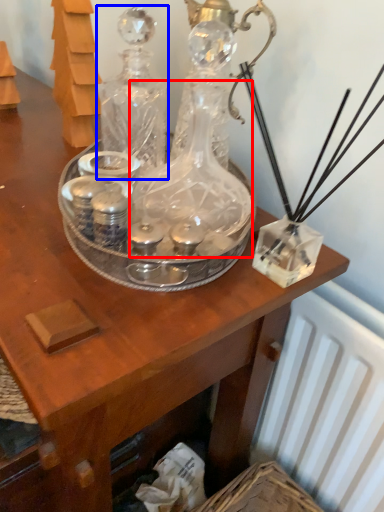
Question: Which object is closer to the camera taking this photo, glass bottle (highlighted by a red box) or glass bottle (highlighted by a blue box)?

Choices:
 (A) glass bottle
 (B) glass bottle

Answer: (A)